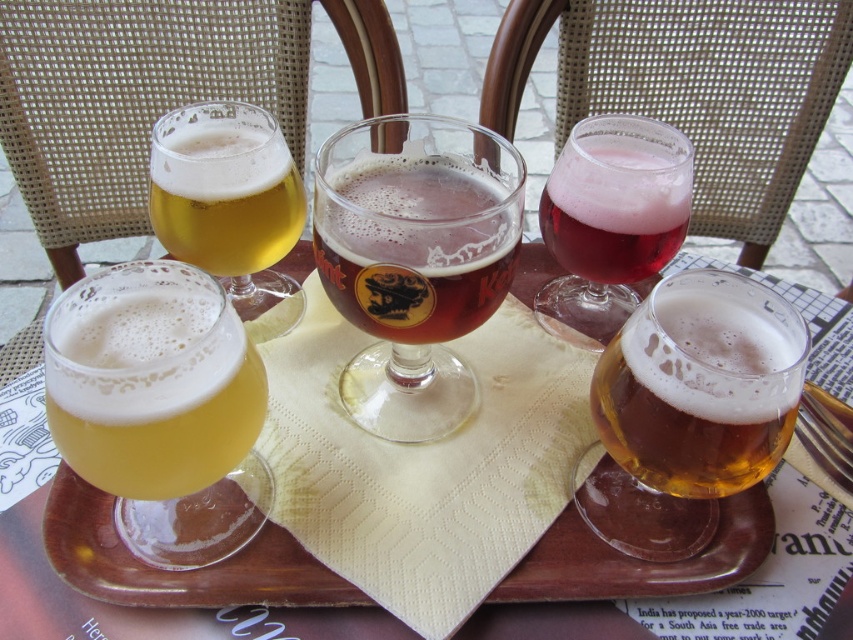
You are a bartender arranging drinks on a tray. You have a translucent glass tray at center and a golden glass beer at upper left. Which object has a greater width?

The translucent glass tray at center has a greater width than the golden glass beer at upper left.

You are a bartender trying to clean the translucent glass tray at center and the brown glass beer at center. Which object should you move first to avoid knocking over the other?

You should move the brown glass beer at center first because it is behind the translucent glass tray at center, so moving the tray first might knock over the beer.